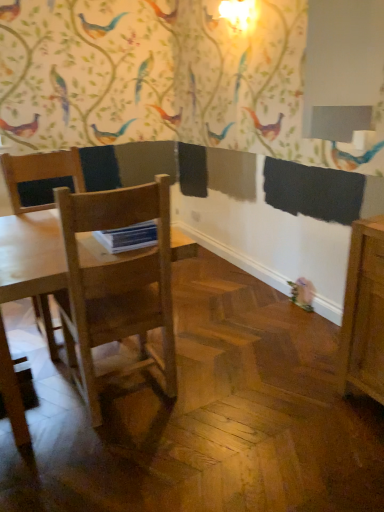
Question: Considering the relative positions of light wood table at center and light brown wood chair at left in the image provided, is light wood table at center to the left of light brown wood chair at left from the viewer's perspective?

Choices:
 (A) no
 (B) yes

Answer: (A)

Question: Is light wood table at center far from light brown wood chair at left?

Choices:
 (A) yes
 (B) no

Answer: (B)

Question: Could light brown wood chair at left be considered to be inside light wood table at center?

Choices:
 (A) no
 (B) yes

Answer: (A)

Question: From a real-world perspective, is light wood table at center located higher than light brown wood chair at left?

Choices:
 (A) no
 (B) yes

Answer: (B)

Question: Is light wood table at center further to camera compared to light brown wood chair at left?

Choices:
 (A) no
 (B) yes

Answer: (A)

Question: From a real-world perspective, does light wood table at center sit lower than light brown wood chair at left?

Choices:
 (A) no
 (B) yes

Answer: (A)

Question: Is the depth of light brown wood chair at left less than that of light wood table at center?

Choices:
 (A) yes
 (B) no

Answer: (B)

Question: Is light brown wood chair at left directly adjacent to light wood table at center?

Choices:
 (A) no
 (B) yes

Answer: (A)

Question: Considering the relative positions of light brown wood chair at left and light wood table at center in the image provided, is light brown wood chair at left to the right of light wood table at center from the viewer's perspective?

Choices:
 (A) no
 (B) yes

Answer: (A)

Question: Is light brown wood chair at left wider than light wood table at center?

Choices:
 (A) no
 (B) yes

Answer: (B)

Question: Are light brown wood chair at left and light wood table at center far apart?

Choices:
 (A) no
 (B) yes

Answer: (A)

Question: Does light brown wood chair at left have a lesser width compared to light wood table at center?

Choices:
 (A) yes
 (B) no

Answer: (B)

Question: Considering the positions of point (39, 273) and point (41, 301), is point (39, 273) closer or farther from the camera than point (41, 301)?

Choices:
 (A) closer
 (B) farther

Answer: (A)